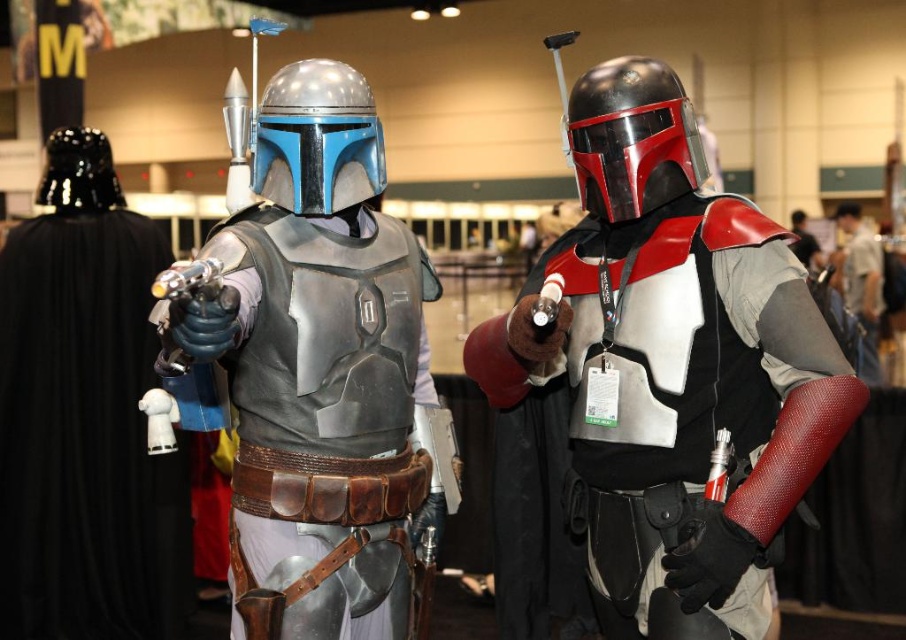
Question: Estimate the real-world distances between objects in this image. Which object is closer to the black matte cape at left?

Choices:
 (A) metallic silver helmet at center
 (B) shiny red armor at center

Answer: (A)

Question: Which object is positioned closest to the black matte cape at left?

Choices:
 (A) metallic silver armor at center
 (B) shiny black helmet at center
 (C) shiny red armor at center

Answer: (A)

Question: Does metallic silver helmet at center come in front of black glossy helmet at left?

Choices:
 (A) no
 (B) yes

Answer: (B)

Question: Considering the relative positions of black matte cape at left and shiny black helmet at center in the image provided, where is black matte cape at left located with respect to shiny black helmet at center?

Choices:
 (A) right
 (B) left

Answer: (B)

Question: Does shiny red armor at center have a lesser width compared to shiny black helmet at center?

Choices:
 (A) no
 (B) yes

Answer: (A)

Question: Which object is farther from the camera taking this photo?

Choices:
 (A) metallic silver helmet at center
 (B) shiny black helmet at center
 (C) black glossy helmet at left

Answer: (C)